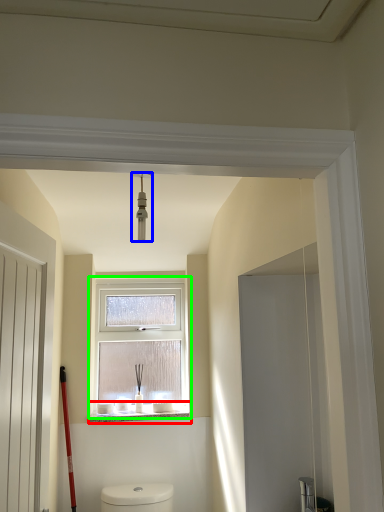
Question: Based on their relative distances, which object is nearer to window sill (highlighted by a red box)? Choose from light fixture (highlighted by a blue box) and window (highlighted by a green box).

Choices:
 (A) light fixture
 (B) window

Answer: (B)